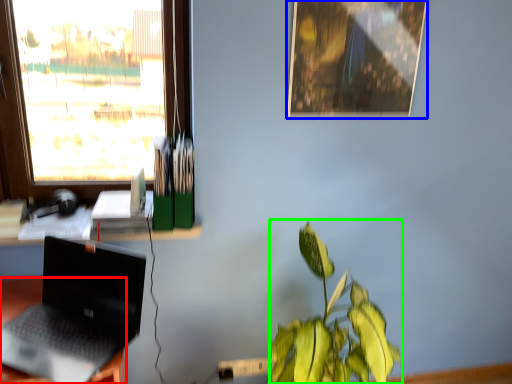
Question: Considering the real-world distances, which object is closest to desk (highlighted by a red box)? picture frame (highlighted by a blue box) or houseplant (highlighted by a green box).

Choices:
 (A) picture frame
 (B) houseplant

Answer: (B)